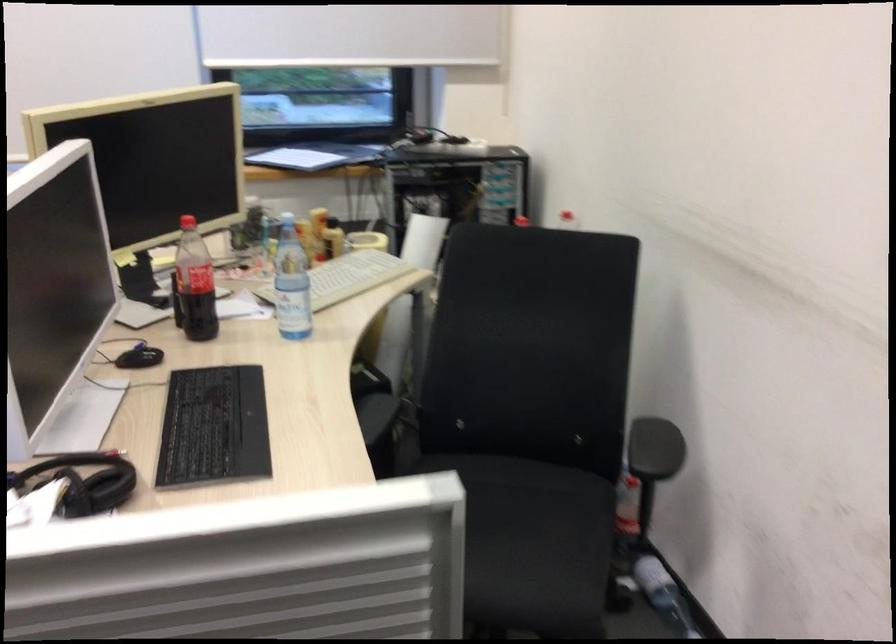
Where would you lift the black keyboard? Please return your answer as a coordinate pair (x, y).

(213, 428)